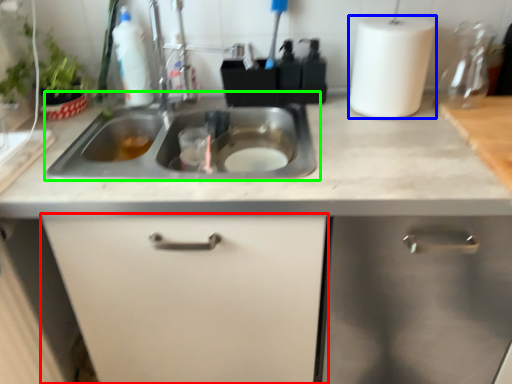
Question: Which object is the closest to the cabinetry (highlighted by a red box)? Choose among these: paper towel (highlighted by a blue box) or sink (highlighted by a green box).

Choices:
 (A) paper towel
 (B) sink

Answer: (B)